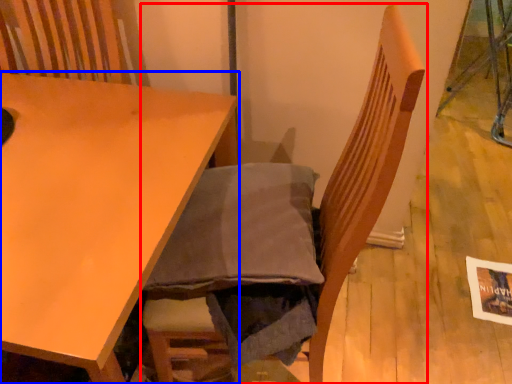
Question: Which object is closer to the camera taking this photo, chair (highlighted by a red box) or table (highlighted by a blue box)?

Choices:
 (A) chair
 (B) table

Answer: (A)